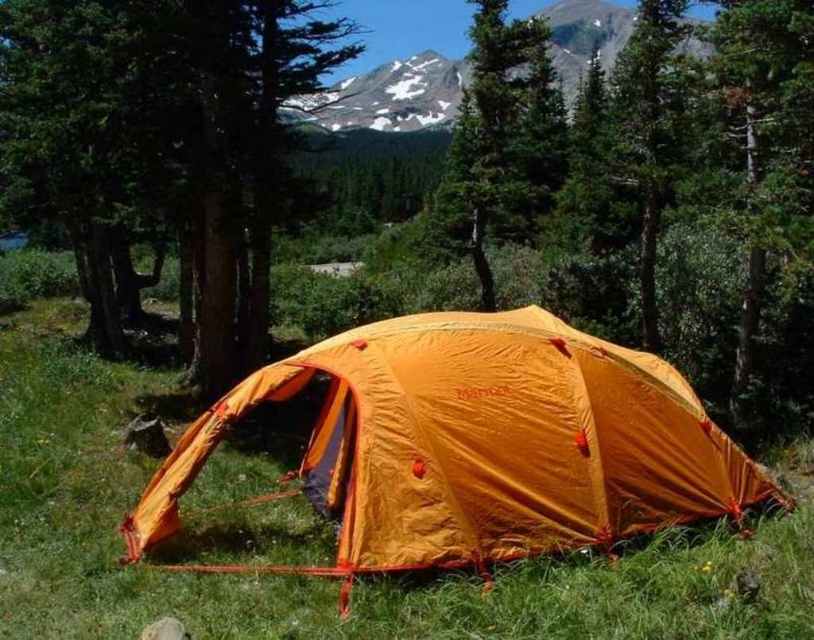
Does orange nylon tent at center have a lesser height compared to snowy rock at upper center?

Yes, orange nylon tent at center is shorter than snowy rock at upper center.

Between orange nylon tent at center and snowy rock at upper center, which one is positioned lower?

orange nylon tent at center is lower down.

Locate an element on the screen. The image size is (814, 640). orange nylon tent at center is located at coordinates (476, 445).

You are a GUI agent. You are given a task and a screenshot of the screen. Output one action in this format:
    pyautogui.click(x=<x>, y=<y>)
    Task: Click on the orange nylon tent at center
    This screenshot has height=640, width=814.
    Given the screenshot: What is the action you would take?
    pyautogui.click(x=476, y=445)

Is orange nylon tent at center smaller than green matte tree at center?

Indeed, orange nylon tent at center has a smaller size compared to green matte tree at center.

This screenshot has width=814, height=640. In order to click on orange nylon tent at center in this screenshot , I will do `click(476, 445)`.

The width and height of the screenshot is (814, 640). Identify the location of orange nylon tent at center. (476, 445).

Is green matte tree at center bigger than snowy rock at upper center?

Incorrect, green matte tree at center is not larger than snowy rock at upper center.

Describe the element at coordinates (162, 147) in the screenshot. I see `green matte tree at center` at that location.

Identify the location of green matte tree at center. This screenshot has width=814, height=640. (162, 147).